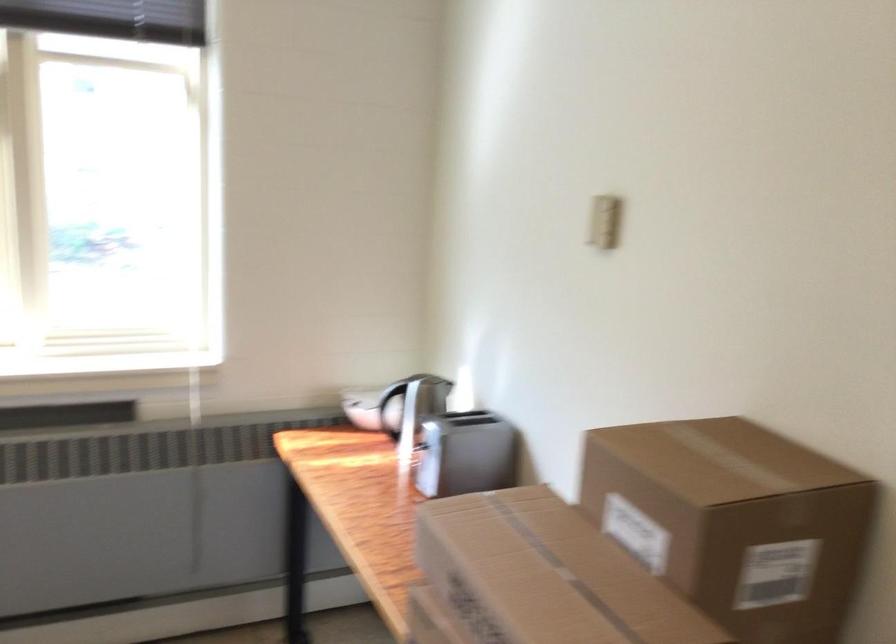
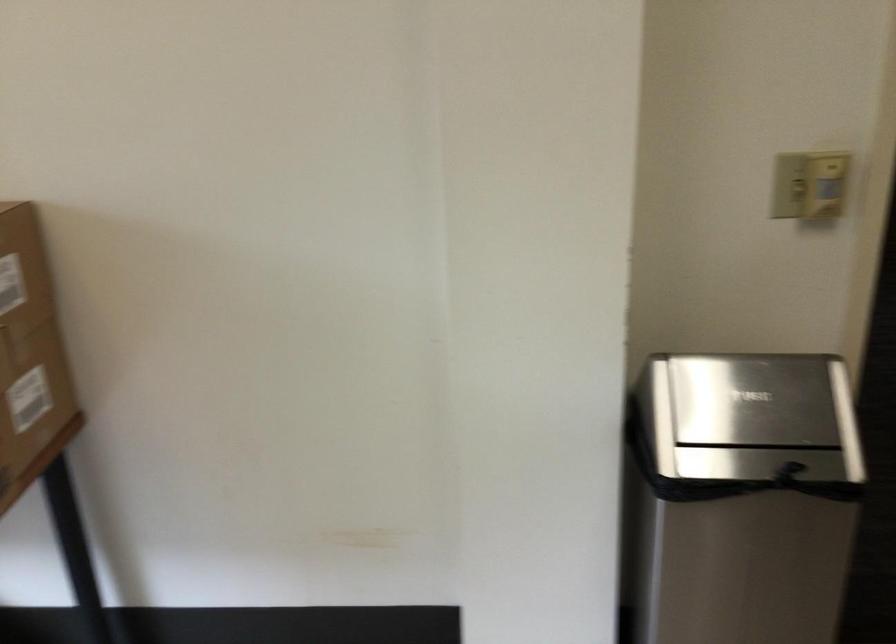
Based on the continuous images, in which direction is the camera rotating?

The camera's rotation is toward right-down.